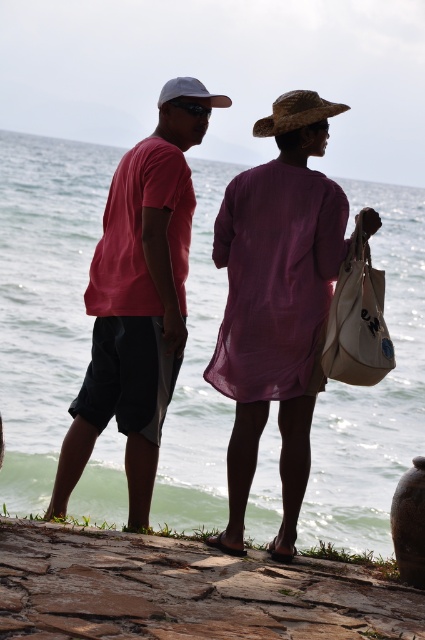
Question: Estimate the real-world distances between objects in this image. Which object is farther from the matte purple dress at center?

Choices:
 (A) matte pink shirt at center
 (B) green water at center

Answer: (B)

Question: Observing the image, what is the correct spatial positioning of green water at center in reference to matte pink shirt at center?

Choices:
 (A) above
 (B) below

Answer: (A)

Question: Does green water at center appear under matte purple dress at center?

Choices:
 (A) no
 (B) yes

Answer: (A)

Question: Where is green water at center located in relation to matte purple dress at center in the image?

Choices:
 (A) left
 (B) right

Answer: (A)

Question: Which of the following is the farthest from the observer?

Choices:
 (A) (73, 289)
 (B) (156, 314)

Answer: (A)

Question: Which object is closer to the camera taking this photo?

Choices:
 (A) green water at center
 (B) matte pink shirt at center

Answer: (A)